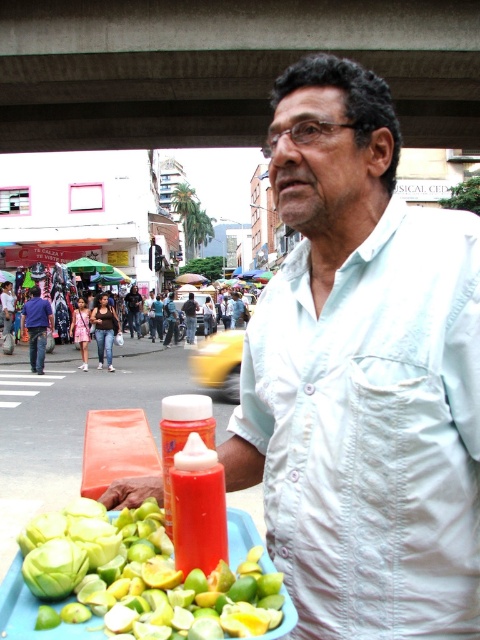
Question: Does white cotton shirt at center have a smaller size compared to green matte cabbage at lower left?

Choices:
 (A) no
 (B) yes

Answer: (A)

Question: Is white cotton shirt at center smaller than green matte fruit at lower left?

Choices:
 (A) yes
 (B) no

Answer: (B)

Question: Which object is positioned closest to the matte black shirt at center?

Choices:
 (A) green matte cabbage at lower left
 (B) white cotton shirt at center
 (C) purple cotton shirt at left

Answer: (C)

Question: Does white cotton shirt at center appear over green matte cabbage at lower left?

Choices:
 (A) no
 (B) yes

Answer: (B)

Question: Considering the real-world distances, which object is closest to the green matte cabbage at lower left?

Choices:
 (A) green matte fruit at lower left
 (B) white cotton shirt at center
 (C) matte white shirt at center

Answer: (A)

Question: Estimate the real-world distances between objects in this image. Which object is farther from the purple cotton shirt at left?

Choices:
 (A) green matte fruit at lower left
 (B) green matte cabbage at lower left
 (C) matte white shirt at center

Answer: (B)